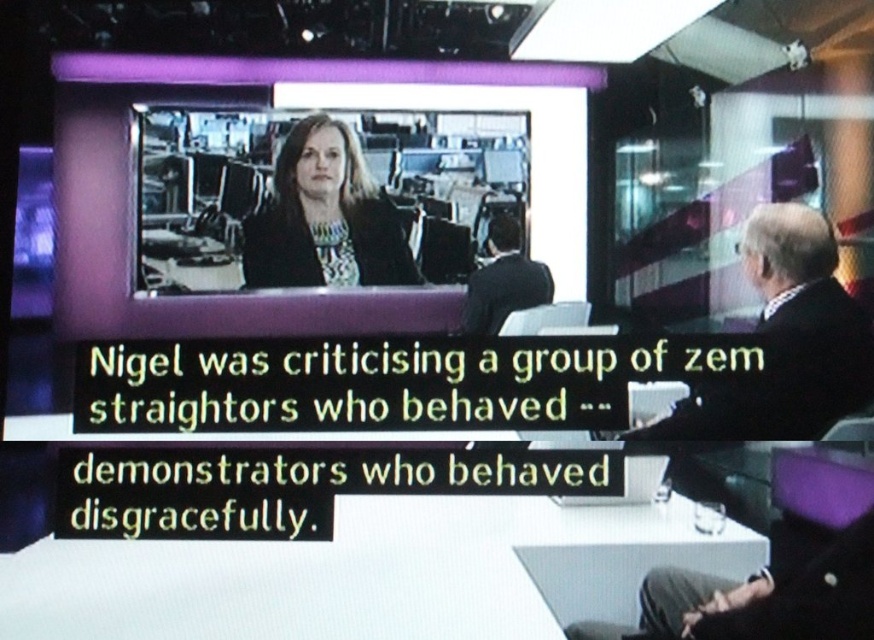
You are a technician adjusting equipment in the studio. You need to connect a cable that is 25 inches long between the matte black laptop at upper center and the black wool suit at right. Will the cable reach?

The matte black laptop at upper center and the black wool suit at right are 25.16 inches apart from each other. The cable is 25 inches long, which is slightly shorter than the distance between them, so the cable will not reach.

You are a camera operator adjusting your shot to focus on the black wool suit at right and the matte black laptop at upper center. Which object should you pan your camera to the right to include in the frame?

The matte black laptop at upper center is to the left of the black wool suit at right. To include the matte black laptop at upper center in the frame, you should pan your camera to the right.